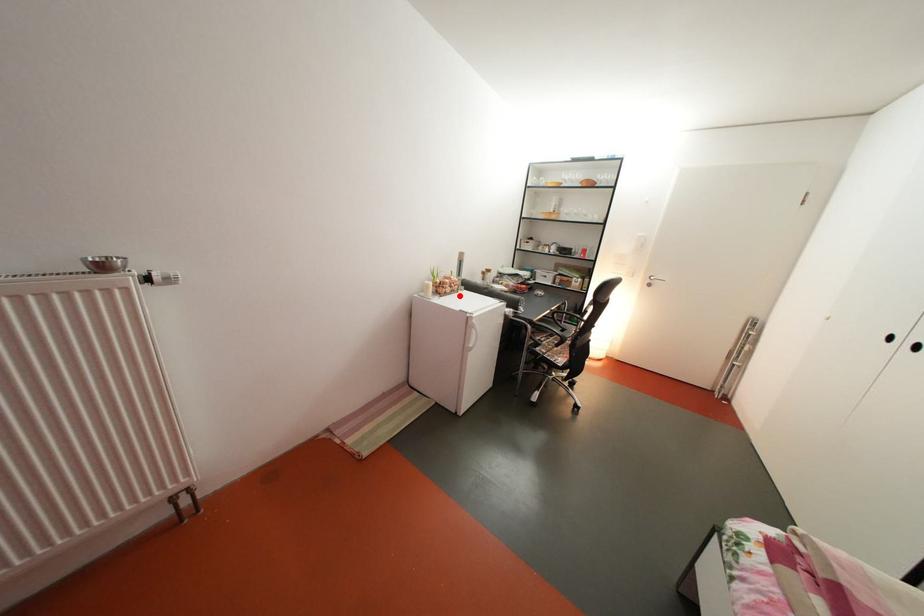
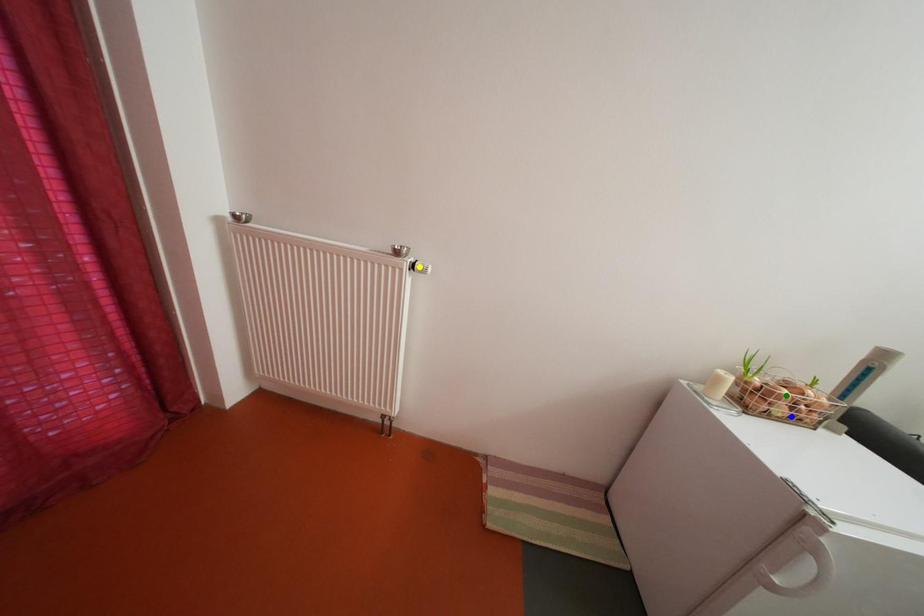
Question: I am providing you with two images of the same scene from different viewpoints. A red point is marked on the first image. You are given multiple points on the second image. Which spot in image 2 lines up with the point in image 1?

Choices:
 (A) green point
 (B) yellow point
 (C) blue point

Answer: (C)